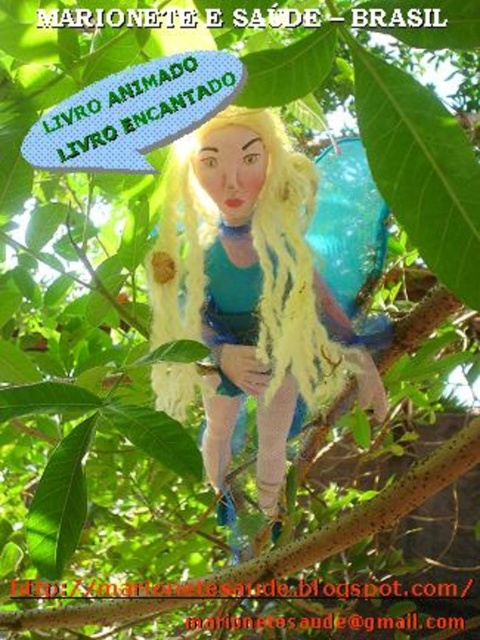
Between fuzzy fabric doll at center and brown rough tree branch at center, which one is positioned lower?

Positioned lower is brown rough tree branch at center.

Who is shorter, fuzzy fabric doll at center or brown rough tree branch at center?

Standing shorter between the two is brown rough tree branch at center.

What do you see at coordinates (248, 292) in the screenshot?
I see `fuzzy fabric doll at center` at bounding box center [248, 292].

The height and width of the screenshot is (640, 480). Identify the location of fuzzy fabric doll at center. (248, 292).